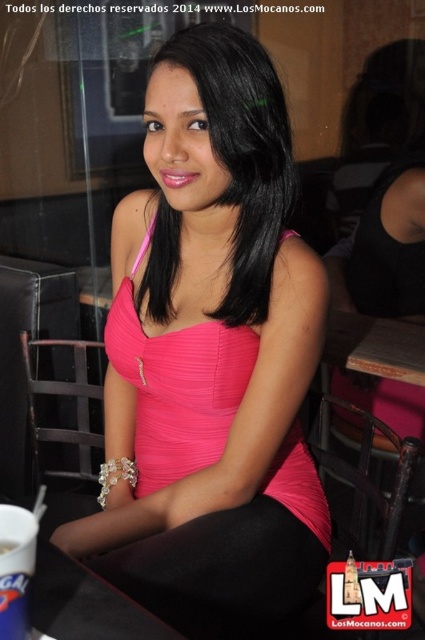
You are a fashion designer observing the woman in the image. You need to determine if the pink satin blouse at center can be folded and stored in the black leather table at lower left. Based on their sizes, what would you conclude?

The pink satin blouse at center is larger in size than the black leather table at lower left, so it cannot be folded and stored inside the table.

You are standing at the position of point (x=57, y=556) and want to walk to the position of point (x=260, y=90). Based on the scene description, will you be moving towards the woman or away from her?

Point (x=260, y=90) is behind point (x=57, y=556), so moving from point (x=57, y=556) to point (x=260, y=90) would mean moving away from the woman since the destination point is behind the starting point relative to her position.

You are standing at the origin point of the image coordinate system. Where is the black leather table at lower left located?

The black leather table at lower left is located at point (85, 604).